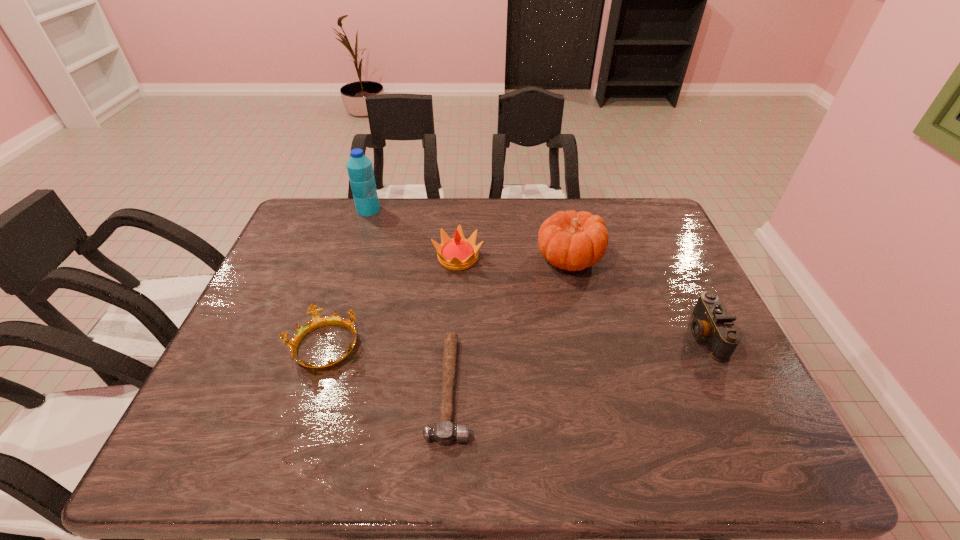
Identify the location of object that stands as the fifth closest to the taller crown. (711, 321).

You are a GUI agent. You are given a task and a screenshot of the screen. Output one action in this format:
    pyautogui.click(x=<x>, y=<y>)
    Task: Click on the object that ranks as the fifth closest to the pumpkin
    The width and height of the screenshot is (960, 540).
    Given the screenshot: What is the action you would take?
    pyautogui.click(x=360, y=170)